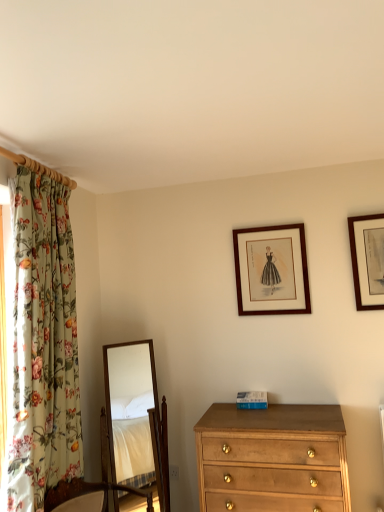
Where is `empty space that is ontop of light brown wood chest of drawers at lower right`? empty space that is ontop of light brown wood chest of drawers at lower right is located at coordinates (282, 413).